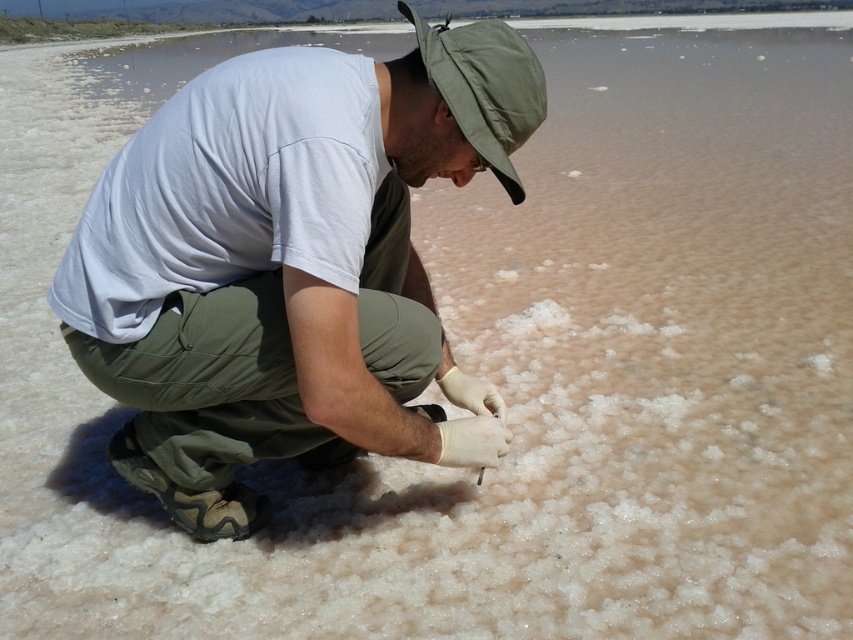
Question: Can you confirm if matte khaki pants at center is positioned below green fabric hat at center?

Choices:
 (A) no
 (B) yes

Answer: (B)

Question: Which object is closer to the camera taking this photo?

Choices:
 (A) matte khaki pants at center
 (B) green fabric hat at center

Answer: (B)

Question: Does matte khaki pants at center appear on the right side of green fabric hat at center?

Choices:
 (A) no
 (B) yes

Answer: (A)

Question: Which object is closer to the camera taking this photo?

Choices:
 (A) matte khaki pants at center
 (B) green fabric hat at center

Answer: (B)

Question: Is matte khaki pants at center wider than green fabric hat at center?

Choices:
 (A) yes
 (B) no

Answer: (A)

Question: Which point is farther to the camera?

Choices:
 (A) (518, 93)
 (B) (502, 28)

Answer: (A)